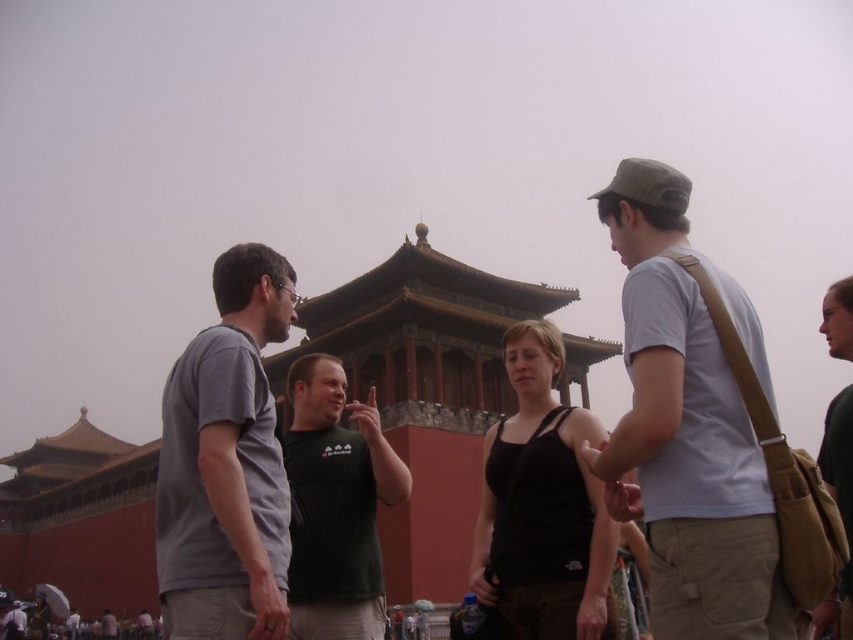
Does light gray cotton t-shirt at center appear over brown leather backpack at right?

Yes, light gray cotton t-shirt at center is above brown leather backpack at right.

This screenshot has height=640, width=853. I want to click on light gray cotton t-shirt at center, so click(x=688, y=428).

Does point (663, 294) lie behind point (839, 304)?

No.

Identify the location of light gray cotton t-shirt at center. This screenshot has height=640, width=853. (688, 428).

Does light gray cotton t-shirt at center have a larger size compared to dark green t-shirt at center?

Indeed, light gray cotton t-shirt at center has a larger size compared to dark green t-shirt at center.

Can you confirm if light gray cotton t-shirt at center is taller than dark green t-shirt at center?

Indeed, light gray cotton t-shirt at center has a greater height compared to dark green t-shirt at center.

Is point (695, 636) more distant than point (374, 464)?

No.

Where is `light gray cotton t-shirt at center`? light gray cotton t-shirt at center is located at coordinates (688, 428).

Who is lower down, dark green t-shirt at center or brown leather backpack at right?

dark green t-shirt at center is below.

The width and height of the screenshot is (853, 640). Describe the element at coordinates (335, 504) in the screenshot. I see `dark green t-shirt at center` at that location.

Between point (311, 579) and point (844, 316), which one is positioned behind?

Point (844, 316)

The height and width of the screenshot is (640, 853). I want to click on dark green t-shirt at center, so click(335, 504).